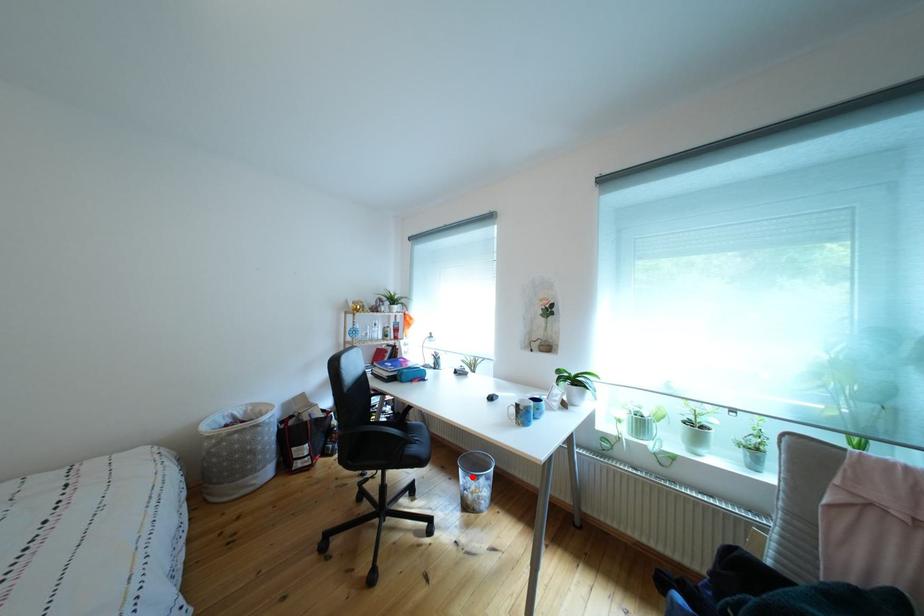
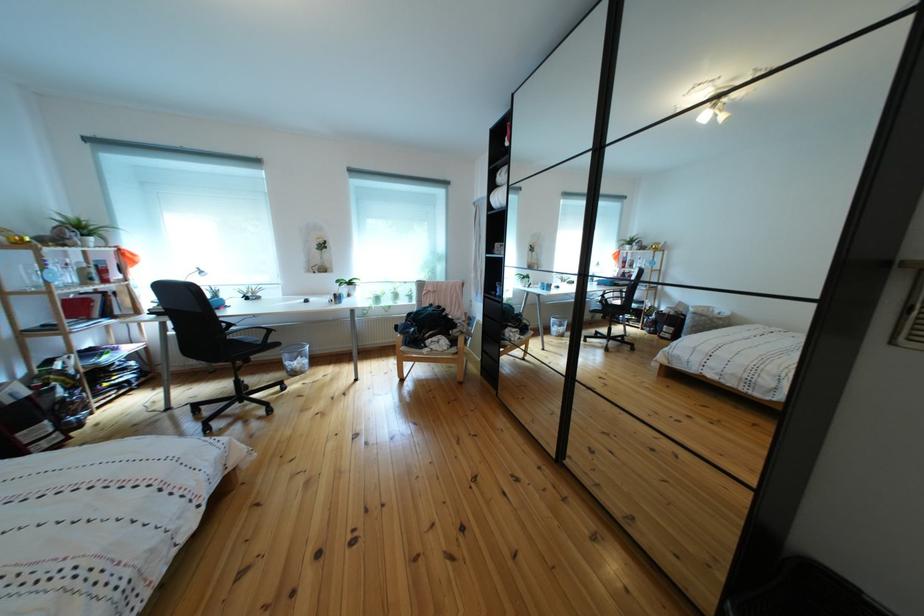
In the second image, find the point that corresponds to the highlighted location in the first image.

(297, 362)